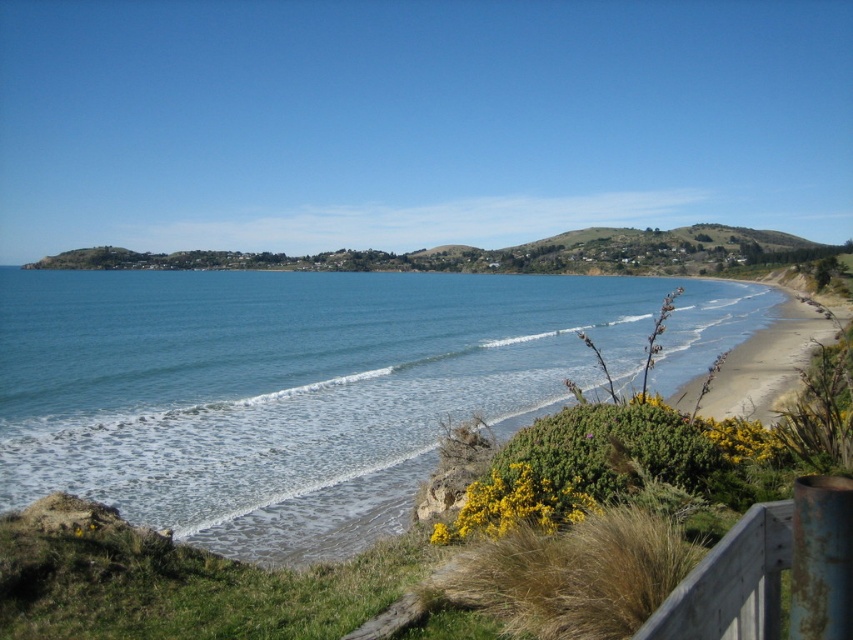
Question: Can you confirm if blue water at center is positioned to the right of light brown sandy beach at right?

Choices:
 (A) yes
 (B) no

Answer: (B)

Question: Which point appears farthest from the camera in this image?

Choices:
 (A) (798, 356)
 (B) (117, 499)

Answer: (A)

Question: Can you confirm if blue water at center is positioned above light brown sandy beach at right?

Choices:
 (A) yes
 (B) no

Answer: (A)

Question: Which of the following is the closest to the observer?

Choices:
 (A) (x=770, y=353)
 (B) (x=724, y=301)

Answer: (A)

Question: Which point is farther to the camera?

Choices:
 (A) light brown sandy beach at right
 (B) blue water at center

Answer: (B)

Question: Does blue water at center have a smaller size compared to light brown sandy beach at right?

Choices:
 (A) yes
 (B) no

Answer: (B)